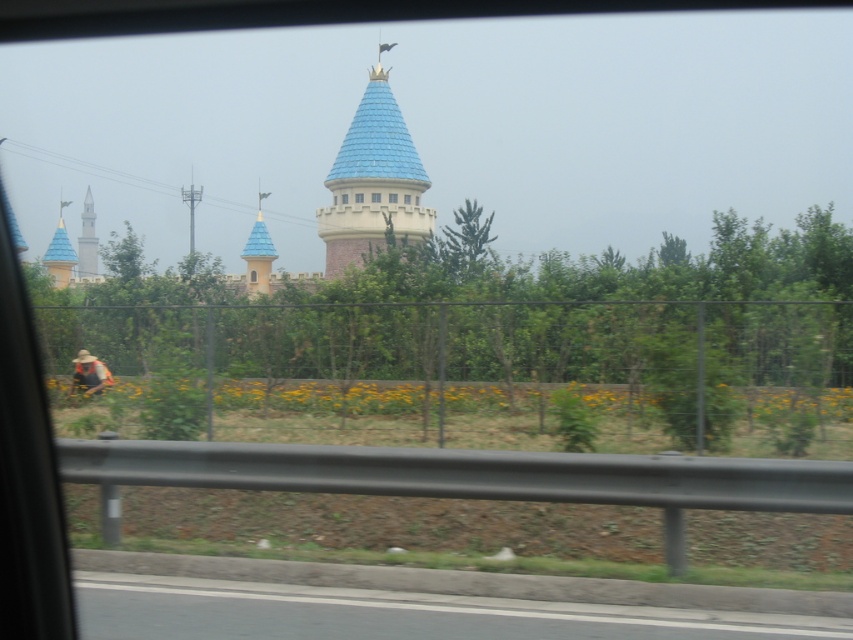
Question: Which object appears closest to the camera in this image?

Choices:
 (A) camouflage fabric man at lower left
 (B) gray asphalt road at lower center
 (C) blue matte spire at center

Answer: (B)

Question: Is the position of blue tiled tower at center more distant than that of blue matte spire at center?

Choices:
 (A) yes
 (B) no

Answer: (B)

Question: Is gray asphalt road at lower center to the right of blue tiled tower at center from the viewer's perspective?

Choices:
 (A) yes
 (B) no

Answer: (A)

Question: Is the position of blue matte spire at center less distant than that of blue glossy spire at left?

Choices:
 (A) no
 (B) yes

Answer: (B)

Question: Which of the following is the closest to the observer?

Choices:
 (A) camouflage fabric man at lower left
 (B) blue tiled tower at center
 (C) blue glossy spire at left
 (D) gray asphalt road at lower center

Answer: (D)

Question: Which of the following is the closest to the observer?

Choices:
 (A) white concrete tower at left
 (B) gray asphalt road at lower center
 (C) camouflage fabric man at lower left

Answer: (B)